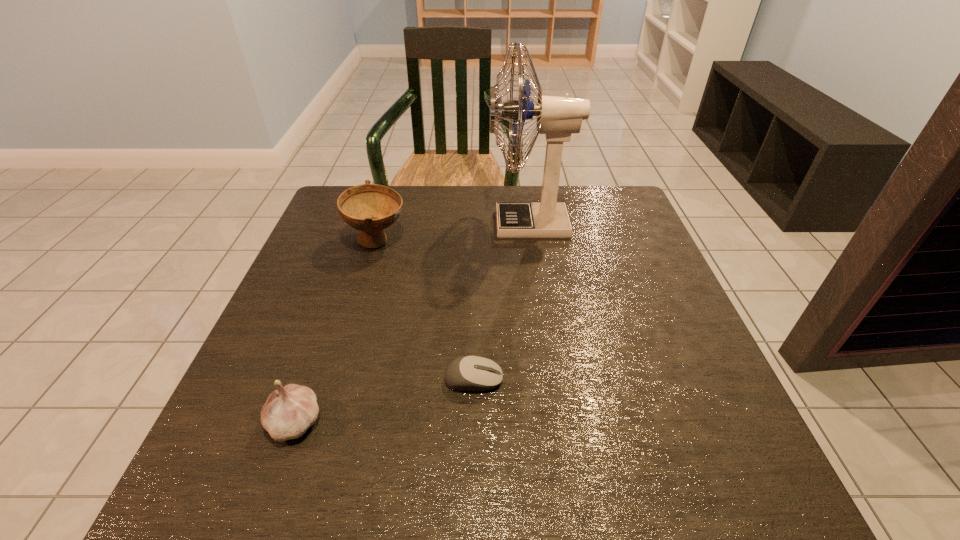
In the image, there is a desktop. Where is `vacant space at the right edge`? The height and width of the screenshot is (540, 960). vacant space at the right edge is located at coordinates [x=650, y=260].

Where is `vacant area at the near left corner`? The image size is (960, 540). vacant area at the near left corner is located at coordinates (192, 502).

Locate an element on the screen. vacant space at the far right corner of the desktop is located at coordinates (626, 223).

The image size is (960, 540). Find the location of `empty location between the shortest object and the nearest object`. empty location between the shortest object and the nearest object is located at coordinates (385, 401).

You are a GUI agent. You are given a task and a screenshot of the screen. Output one action in this format:
    pyautogui.click(x=<x>, y=<y>)
    Task: Click on the unoccupied position between the garlic and the tallest object
    The height and width of the screenshot is (540, 960).
    Given the screenshot: What is the action you would take?
    pyautogui.click(x=413, y=323)

In order to click on vacant region between the nearest object and the computer equipment in this screenshot , I will do pyautogui.click(x=385, y=401).

Identify the location of vacant point located between the second tallest object and the tallest object. This screenshot has width=960, height=540. (453, 233).

This screenshot has width=960, height=540. I want to click on empty space that is in between the third farthest object and the third tallest object, so click(x=385, y=401).

At what (x,y) coordinates should I click in order to perform the action: click on vacant space that's between the garlic and the second tallest object. Please return your answer as a coordinate pair (x, y). The width and height of the screenshot is (960, 540). Looking at the image, I should click on (337, 332).

Find the location of `free space between the second nearest object and the fan`. free space between the second nearest object and the fan is located at coordinates (502, 302).